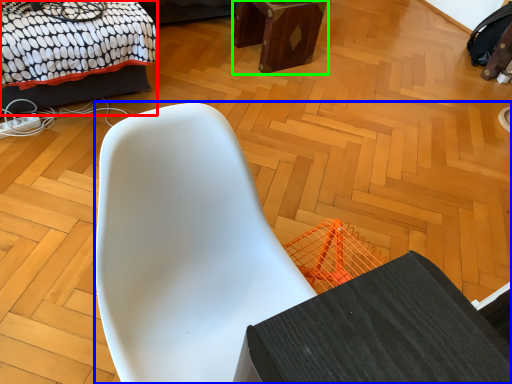
Question: Estimate the real-world distances between objects in this image. Which object is closer to bed (highlighted by a red box), chair (highlighted by a blue box) or furniture (highlighted by a green box)?

Choices:
 (A) chair
 (B) furniture

Answer: (B)